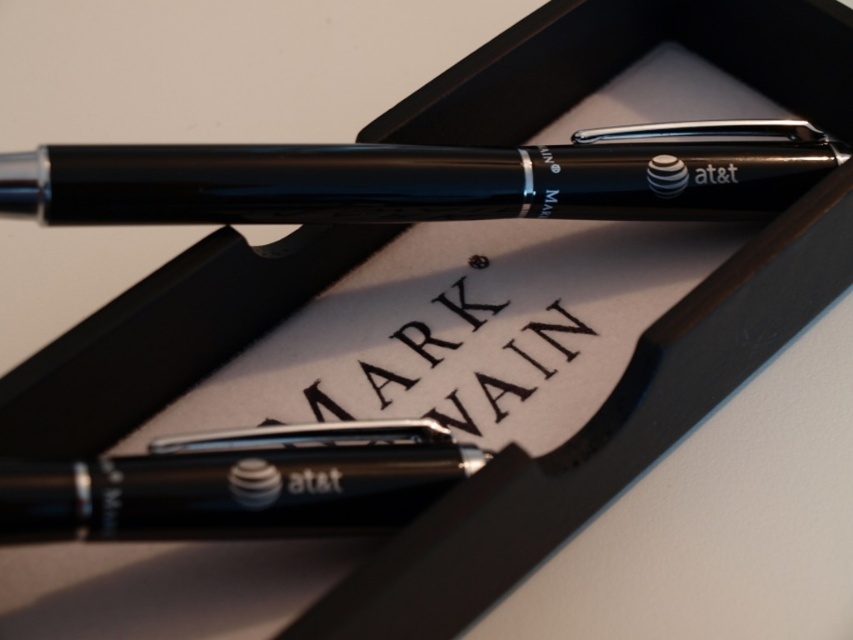
You are an office worker who needs to grab a pen quickly. You see the matte black pen at upper center and the black metallic pen at center. Which pen can you reach first without moving the other?

The matte black pen at upper center can be reached first because the black metallic pen at center is behind it, making it more accessible.

You are designing a layout for a product catalog and need to place an icon exactly where the matte black pen at upper center is located. According to the image coordinates, where should you position the icon?

The icon should be positioned at the coordinates point (427, 179) where the matte black pen at upper center is located.